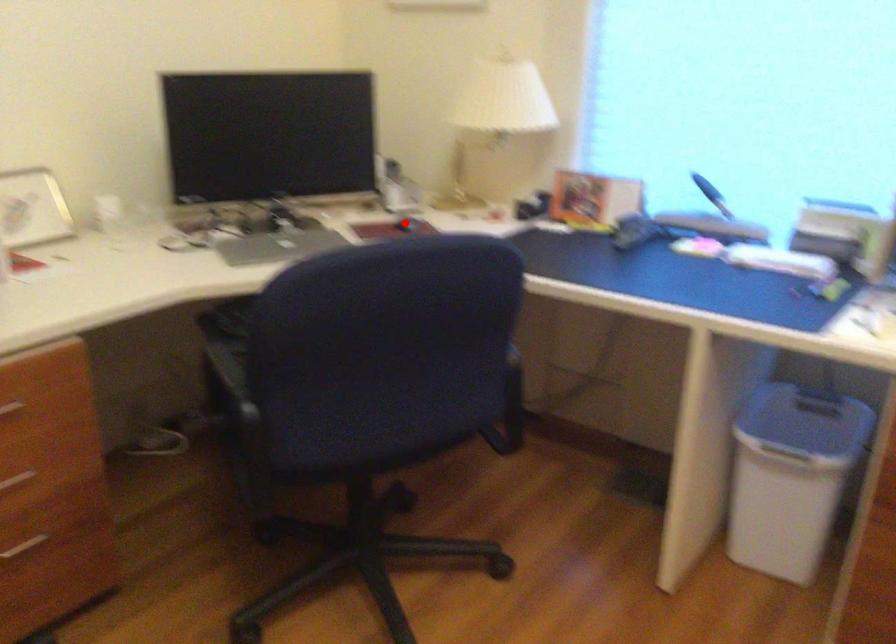
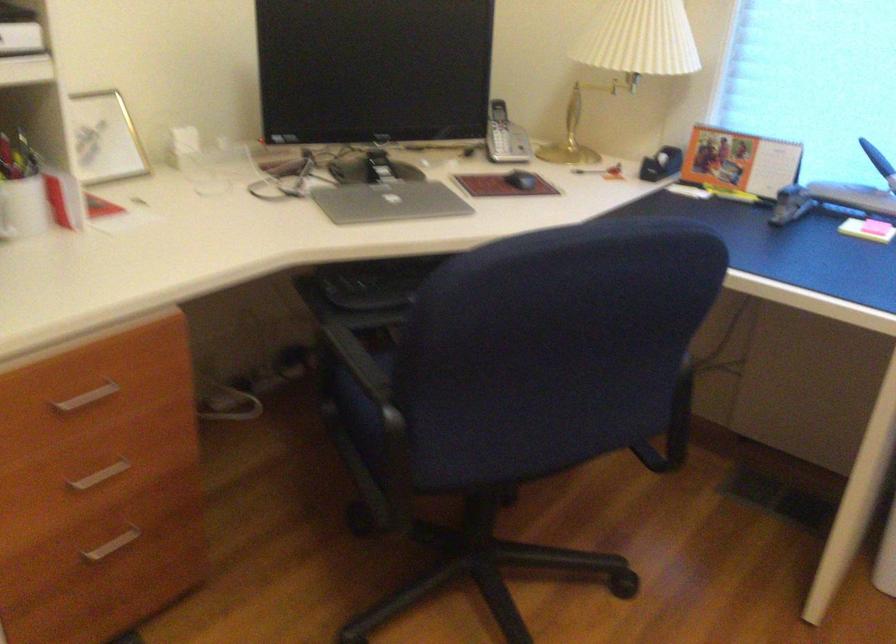
Where in the second image is the point corresponding to the highlighted location from the first image?

(521, 180)